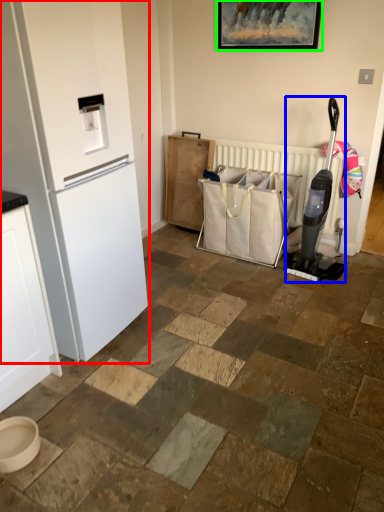
Question: Which object is the closest to the refrigerator (highlighted by a red box)? Choose among these: appliance (highlighted by a blue box) or picture frame (highlighted by a green box).

Choices:
 (A) appliance
 (B) picture frame

Answer: (A)